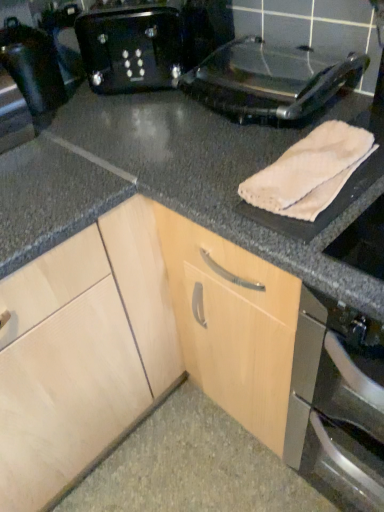
Question: From the image's perspective, is shiny black toaster at left beneath beige soft towel at upper right?

Choices:
 (A) yes
 (B) no

Answer: (B)

Question: Considering the relative positions of shiny black toaster at left and beige soft towel at upper right in the image provided, is shiny black toaster at left behind beige soft towel at upper right?

Choices:
 (A) no
 (B) yes

Answer: (B)

Question: Can beige soft towel at upper right be found inside shiny black toaster at left?

Choices:
 (A) no
 (B) yes

Answer: (A)

Question: Is shiny black toaster at left closer to camera compared to beige soft towel at upper right?

Choices:
 (A) no
 (B) yes

Answer: (A)

Question: Would you say shiny black toaster at left is outside beige soft towel at upper right?

Choices:
 (A) yes
 (B) no

Answer: (A)

Question: Relative to black plastic toaster at upper center, is shiny black toaster at left in front or behind?

Choices:
 (A) behind
 (B) front

Answer: (B)

Question: In terms of height, does shiny black toaster at left look taller or shorter compared to black plastic toaster at upper center?

Choices:
 (A) tall
 (B) short

Answer: (B)

Question: Looking at their shapes, would you say shiny black toaster at left is wider or thinner than black plastic toaster at upper center?

Choices:
 (A) thin
 (B) wide

Answer: (A)

Question: Is point (9, 126) positioned closer to the camera than point (153, 26)?

Choices:
 (A) farther
 (B) closer

Answer: (B)

Question: From their relative heights in the image, would you say black plastic toaster at upper center is taller or shorter than white fabric towel at right?

Choices:
 (A) short
 (B) tall

Answer: (A)

Question: Would you say black plastic toaster at upper center is to the left or to the right of white fabric towel at right in the picture?

Choices:
 (A) left
 (B) right

Answer: (A)

Question: Is black plastic toaster at upper center bigger or smaller than white fabric towel at right?

Choices:
 (A) big
 (B) small

Answer: (B)

Question: Considering the positions of point (82, 53) and point (302, 351), is point (82, 53) closer or farther from the camera than point (302, 351)?

Choices:
 (A) farther
 (B) closer

Answer: (A)

Question: From the image's perspective, is beige soft towel at upper right located above or below shiny black toaster at left?

Choices:
 (A) above
 (B) below

Answer: (B)

Question: Considering the positions of beige soft towel at upper right and shiny black toaster at left in the image, is beige soft towel at upper right wider or thinner than shiny black toaster at left?

Choices:
 (A) thin
 (B) wide

Answer: (B)